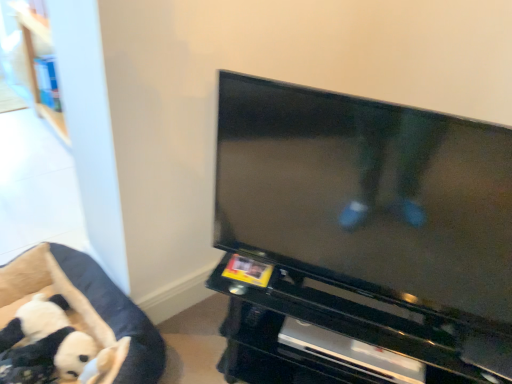
Question: Considering the relative sizes of black plush toy at lower left and soft plush dog bed at lower left in the image provided, is black plush toy at lower left bigger than soft plush dog bed at lower left?

Choices:
 (A) no
 (B) yes

Answer: (A)

Question: Is black plush toy at lower left not within soft plush dog bed at lower left?

Choices:
 (A) no
 (B) yes

Answer: (A)

Question: Can you confirm if black plush toy at lower left is smaller than soft plush dog bed at lower left?

Choices:
 (A) no
 (B) yes

Answer: (B)

Question: Is black plush toy at lower left closer to camera compared to soft plush dog bed at lower left?

Choices:
 (A) yes
 (B) no

Answer: (B)

Question: From the image's perspective, is black plush toy at lower left above soft plush dog bed at lower left?

Choices:
 (A) no
 (B) yes

Answer: (A)

Question: From the image's perspective, is black plush toy at lower left beneath soft plush dog bed at lower left?

Choices:
 (A) no
 (B) yes

Answer: (B)

Question: Considering the relative sizes of black plush toy at lower left and black glossy entertainment center at center in the image provided, is black plush toy at lower left bigger than black glossy entertainment center at center?

Choices:
 (A) yes
 (B) no

Answer: (B)

Question: From a real-world perspective, is black plush toy at lower left located higher than black glossy entertainment center at center?

Choices:
 (A) no
 (B) yes

Answer: (A)

Question: Does black plush toy at lower left contain black glossy entertainment center at center?

Choices:
 (A) yes
 (B) no

Answer: (B)

Question: Is black plush toy at lower left facing away from black glossy entertainment center at center?

Choices:
 (A) no
 (B) yes

Answer: (A)

Question: Considering the relative sizes of black plush toy at lower left and black glossy entertainment center at center in the image provided, is black plush toy at lower left thinner than black glossy entertainment center at center?

Choices:
 (A) yes
 (B) no

Answer: (A)

Question: Considering the relative sizes of black plush toy at lower left and black glossy entertainment center at center in the image provided, is black plush toy at lower left taller than black glossy entertainment center at center?

Choices:
 (A) yes
 (B) no

Answer: (B)

Question: Is black plush toy at lower left thinner than black glossy tv at center?

Choices:
 (A) yes
 (B) no

Answer: (B)